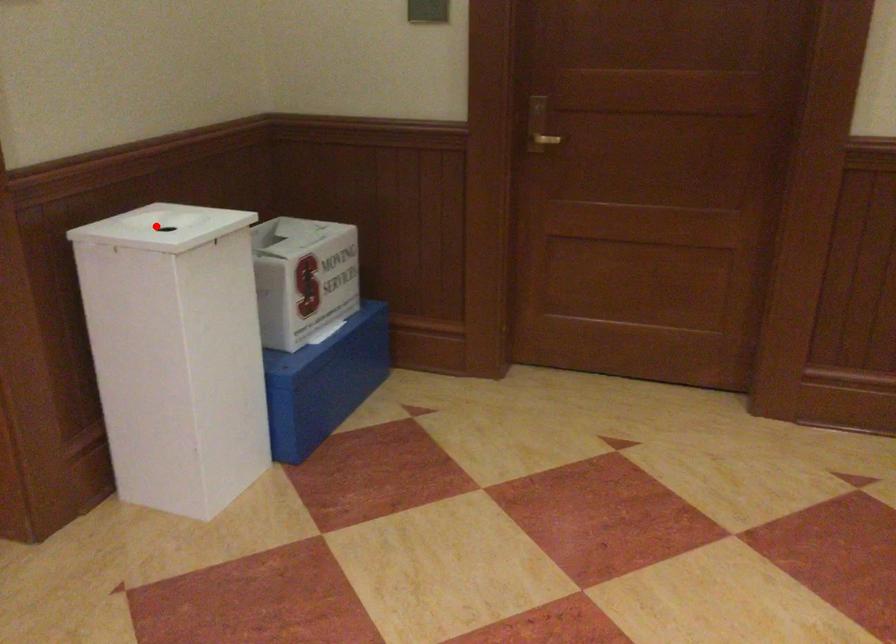
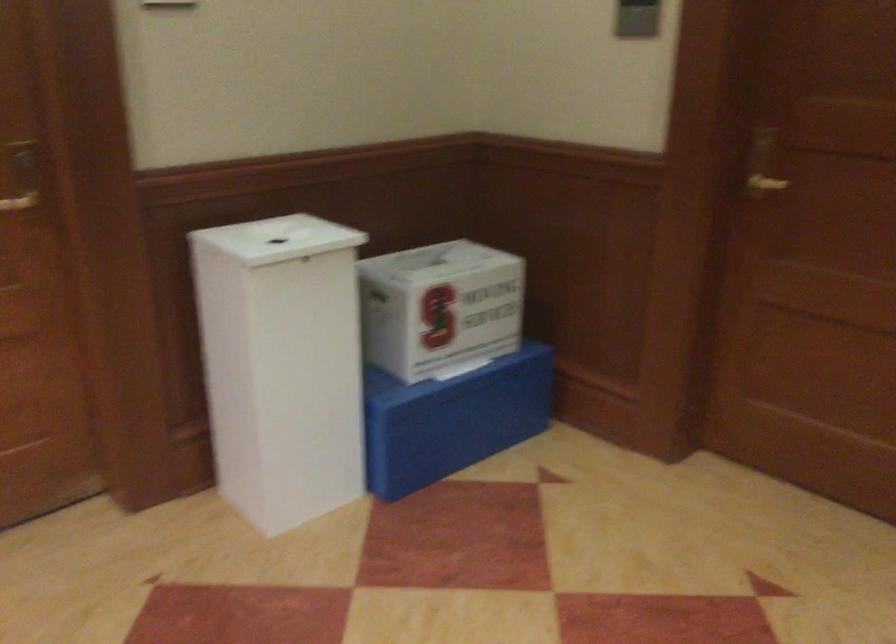
The point at the highlighted location is marked in the first image. Where is the corresponding point in the second image?

(277, 238)